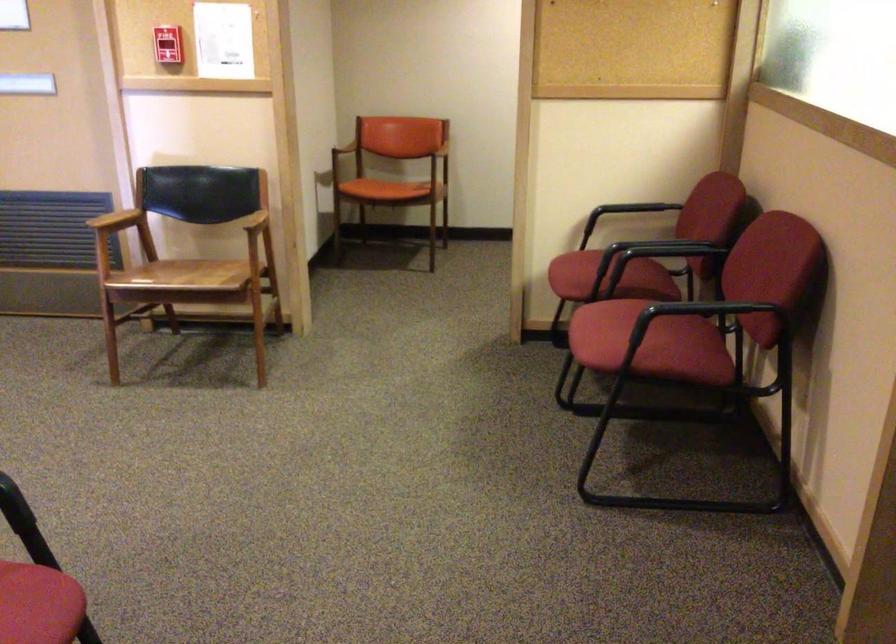
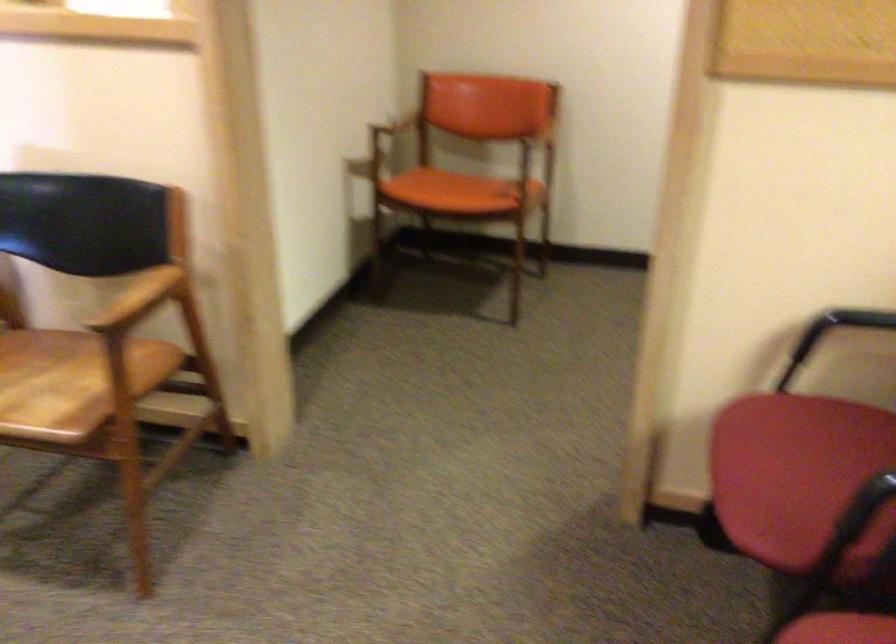
Question: In a continuous first-person perspective shot, in which direction is the camera moving?

Choices:
 (A) Left
 (B) Right
 (C) Forward
 (D) Backward

Answer: (C)